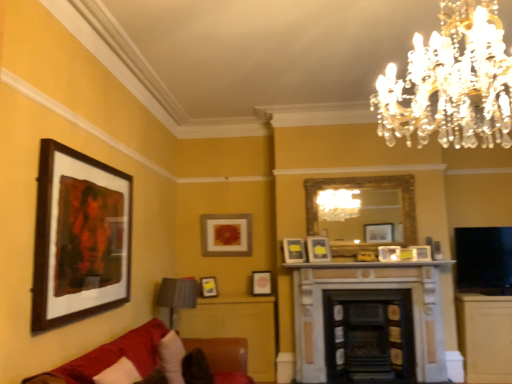
Image resolution: width=512 pixels, height=384 pixels. Find the location of `vacant area on top of wooden framed artwork at left, the first picture frame positioned from the left (from a real-world perspective)`. vacant area on top of wooden framed artwork at left, the first picture frame positioned from the left (from a real-world perspective) is located at coordinates (100, 152).